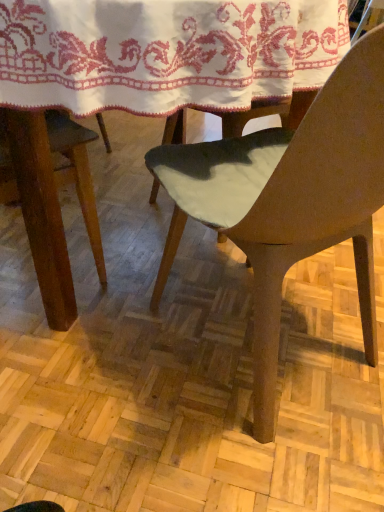
The image size is (384, 512). Describe the element at coordinates (166, 53) in the screenshot. I see `white embroidered cloth at upper center` at that location.

You are a GUI agent. You are given a task and a screenshot of the screen. Output one action in this format:
    pyautogui.click(x=<x>, y=<y>)
    Task: Click on the white embroidered cloth at upper center
    
    Given the screenshot: What is the action you would take?
    pyautogui.click(x=166, y=53)

In order to face white embroidered cloth at upper center, should I rotate leftwards or rightwards?

Turn left by 6.518 degrees to look at white embroidered cloth at upper center.

The height and width of the screenshot is (512, 384). I want to click on matte brown chair at center, so click(290, 200).

What is the approximate width of matte brown chair at center?

matte brown chair at center is 54.68 centimeters wide.

The image size is (384, 512). What do you see at coordinates (290, 200) in the screenshot?
I see `matte brown chair at center` at bounding box center [290, 200].

In order to face matte brown chair at center, should I rotate leftwards or rightwards?

Turn right approximately 11.682 degrees to face it.

This screenshot has width=384, height=512. Identify the location of white embroidered cloth at upper center. (166, 53).

Between matte brown chair at center and white embroidered cloth at upper center, which one appears on the right side from the viewer's perspective?

From the viewer's perspective, matte brown chair at center appears more on the right side.

Considering the relative positions of matte brown chair at center and white embroidered cloth at upper center in the image provided, is matte brown chair at center behind white embroidered cloth at upper center?

No.

Is point (268, 173) farther from camera compared to point (17, 106)?

Yes, point (268, 173) is farther from viewer.

From the image's perspective, is matte brown chair at center located above white embroidered cloth at upper center?

No.

From a real-world perspective, which is physically above, matte brown chair at center or white embroidered cloth at upper center?

white embroidered cloth at upper center.

Between matte brown chair at center and white embroidered cloth at upper center, which one has larger width?

white embroidered cloth at upper center is wider.

In terms of height, does matte brown chair at center look taller or shorter compared to white embroidered cloth at upper center?

In the image, matte brown chair at center appears to be taller than white embroidered cloth at upper center.

Considering the sizes of objects matte brown chair at center and white embroidered cloth at upper center in the image provided, who is smaller, matte brown chair at center or white embroidered cloth at upper center?

Smaller between the two is matte brown chair at center.

Is matte brown chair at center not inside white embroidered cloth at upper center?

Yes, matte brown chair at center is outside of white embroidered cloth at upper center.

Can you see matte brown chair at center touching white embroidered cloth at upper center?

No, matte brown chair at center is not in contact with white embroidered cloth at upper center.

Is matte brown chair at center aimed at white embroidered cloth at upper center?

Yes, matte brown chair at center is oriented towards white embroidered cloth at upper center.

What's the angular difference between matte brown chair at center and white embroidered cloth at upper center's facing directions?

There is a 180-degree angle between the facing directions of matte brown chair at center and white embroidered cloth at upper center.

Measure the distance from matte brown chair at center to white embroidered cloth at upper center.

matte brown chair at center and white embroidered cloth at upper center are 10.32 inches apart from each other.

Where is `chair that appears below the white embroidered cloth at upper center (from a real-world perspective)`? The height and width of the screenshot is (512, 384). chair that appears below the white embroidered cloth at upper center (from a real-world perspective) is located at coordinates (290, 200).

Would you say white embroidered cloth at upper center is to the left or to the right of matte brown chair at center in the picture?

From the image, it's evident that white embroidered cloth at upper center is to the left of matte brown chair at center.

Is white embroidered cloth at upper center further to camera compared to matte brown chair at center?

Yes, the depth of white embroidered cloth at upper center is greater than that of matte brown chair at center.

Which point is more forward, (132, 96) or (334, 87)?

Point (334, 87)

From the image's perspective, which one is positioned lower, white embroidered cloth at upper center or matte brown chair at center?

matte brown chair at center is shown below in the image.

From a real-world perspective, who is located higher, white embroidered cloth at upper center or matte brown chair at center?

white embroidered cloth at upper center.

Can you confirm if white embroidered cloth at upper center is wider than matte brown chair at center?

Yes.

Between white embroidered cloth at upper center and matte brown chair at center, which one has less height?

Standing shorter between the two is white embroidered cloth at upper center.

Based on their sizes in the image, would you say white embroidered cloth at upper center is bigger or smaller than matte brown chair at center?

Considering their sizes, white embroidered cloth at upper center takes up more space than matte brown chair at center.

Is matte brown chair at center located within white embroidered cloth at upper center?

No, matte brown chair at center is not a part of white embroidered cloth at upper center.

Does white embroidered cloth at upper center touch matte brown chair at center?

No, white embroidered cloth at upper center is not making contact with matte brown chair at center.

Is white embroidered cloth at upper center facing towards matte brown chair at center?

Yes, white embroidered cloth at upper center is facing matte brown chair at center.

Can you tell me how much white embroidered cloth at upper center and matte brown chair at center differ in facing direction?

The angular difference between white embroidered cloth at upper center and matte brown chair at center is 180 degrees.

The height and width of the screenshot is (512, 384). What are the coordinates of `chair below the white embroidered cloth at upper center (from a real-world perspective)` in the screenshot? It's located at (290, 200).

Where is `chair lying below the white embroidered cloth at upper center (from the image's perspective)`? The width and height of the screenshot is (384, 512). chair lying below the white embroidered cloth at upper center (from the image's perspective) is located at coordinates (290, 200).

The width and height of the screenshot is (384, 512). In order to click on blanket on the left side of matte brown chair at center in this screenshot , I will do tap(166, 53).